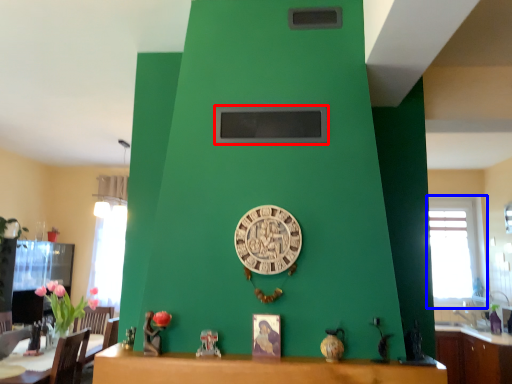
Question: Which of the following is the closest to the observer, window screen (highlighted by a red box) or window (highlighted by a blue box)?

Choices:
 (A) window screen
 (B) window

Answer: (A)